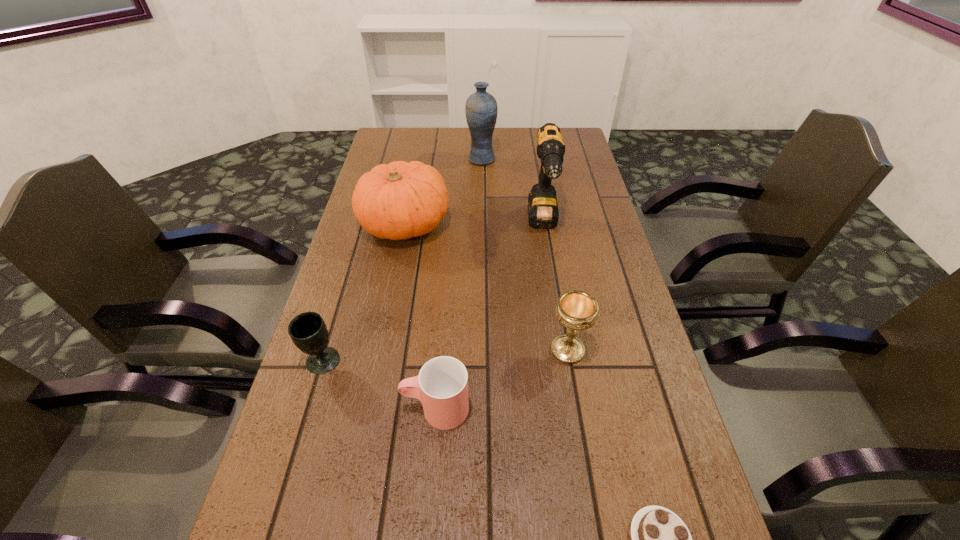
You are a GUI agent. You are given a task and a screenshot of the screen. Output one action in this format:
    pyautogui.click(x=<x>, y=<y>)
    Task: Click on the drill
    The image size is (960, 540).
    Given the screenshot: What is the action you would take?
    pyautogui.click(x=543, y=212)

Locate an element on the screen. This screenshot has width=960, height=540. vase is located at coordinates (481, 109).

The image size is (960, 540). I want to click on pumpkin, so click(x=401, y=200).

Locate an element on the screen. This screenshot has width=960, height=540. the right chalice is located at coordinates (577, 310).

Identify the location of the left chalice. (308, 331).

Identify the location of cup. The width and height of the screenshot is (960, 540). (442, 384).

Locate an element on the screen. Image resolution: width=960 pixels, height=540 pixels. vacant position located at the tip of the drill is located at coordinates (555, 300).

I want to click on vacant space situated on the left of the farthest object, so click(x=373, y=159).

Identify the location of vacant area situated 0.220m on the front of the pumpkin. The height and width of the screenshot is (540, 960). (388, 315).

The height and width of the screenshot is (540, 960). In order to click on vacant area located 0.200m on the left of the right chalice in this screenshot , I will do `click(459, 350)`.